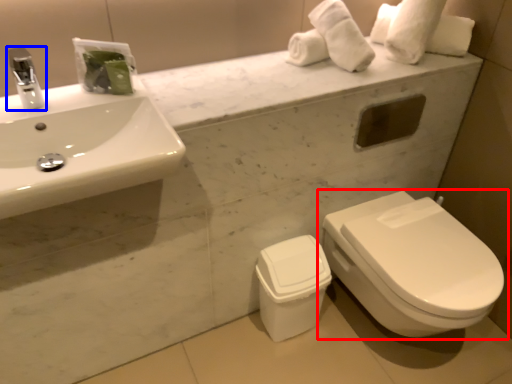
Question: Which object is closer to the camera taking this photo, toilet (highlighted by a red box) or tap (highlighted by a blue box)?

Choices:
 (A) toilet
 (B) tap

Answer: (B)